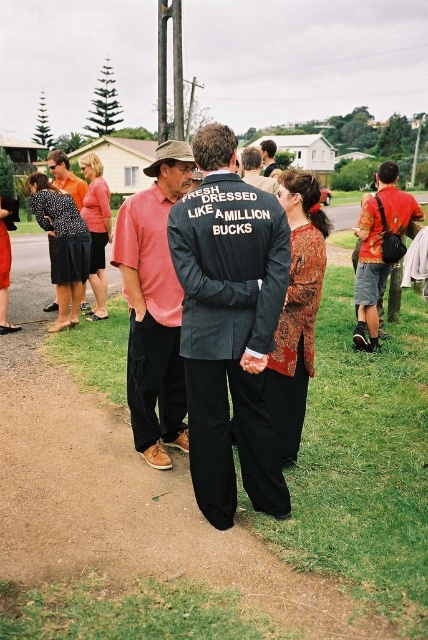
You are a photographer trying to capture both the dark pinstripe suit at center and the matte black suit at center in a single shot. Based on their positions, which one is closer to the camera?

The dark pinstripe suit at center is closer to the camera because it is in front of the matte black suit at center.

You are standing at the center of the image. Which direction should you move to locate the dark pinstripe suit at center?

The dark pinstripe suit at center is already at your current position since it is located at point (228,326), which is near the center of the image.